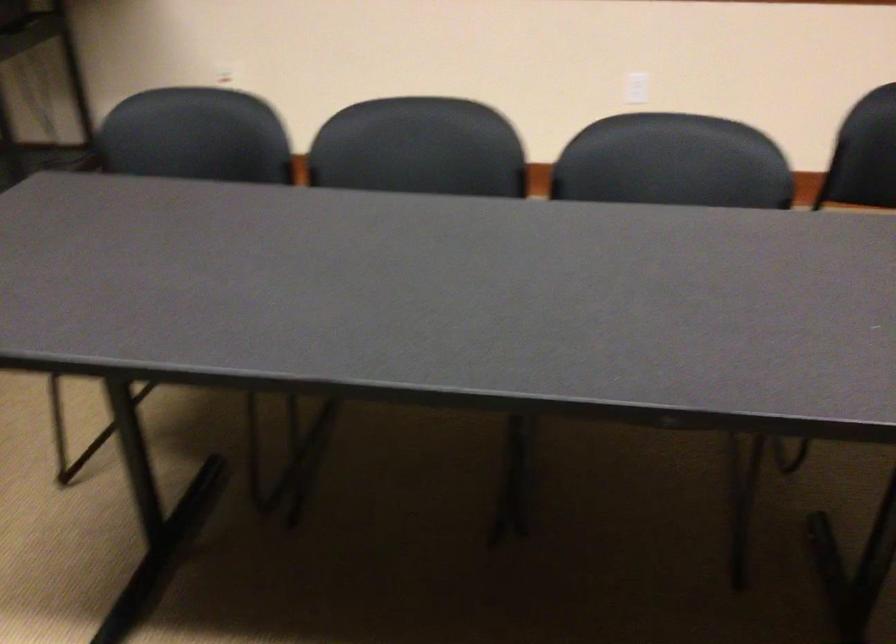
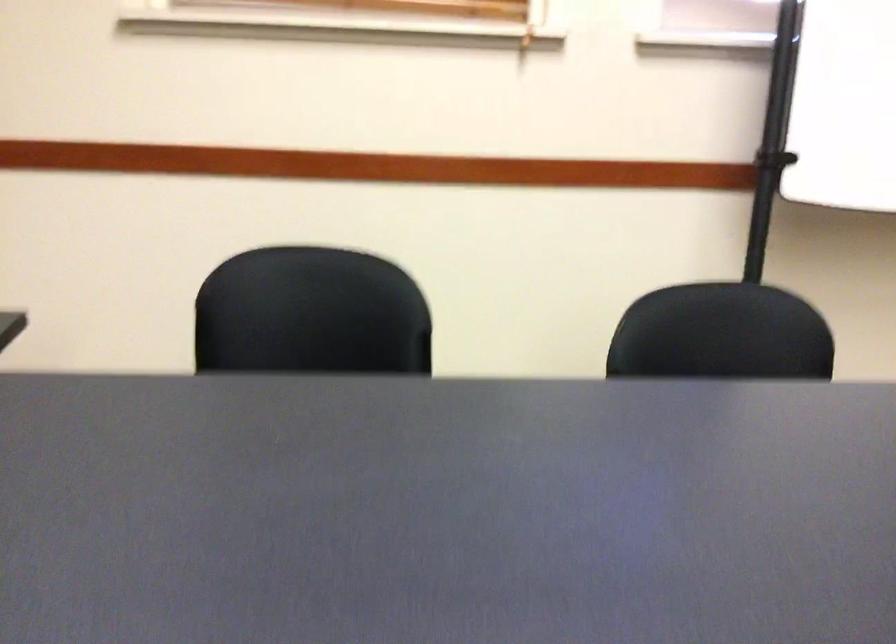
Based on the continuous images, in which direction is the camera rotating?

The camera's rotation is toward left-down.